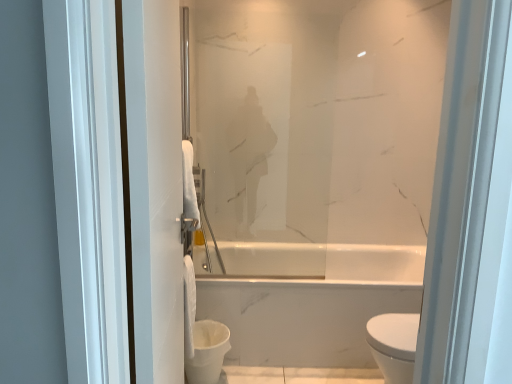
Question: Is white glossy toilet bowl at lower center to the left or to the right of satin glass mirror at center in the image?

Choices:
 (A) right
 (B) left

Answer: (B)

Question: In terms of width, does white glossy toilet bowl at lower center look wider or thinner when compared to satin glass mirror at center?

Choices:
 (A) wide
 (B) thin

Answer: (A)

Question: Considering the real-world distances, which object is farthest from the satin glass mirror at center?

Choices:
 (A) white matte towel at left
 (B) white glossy toilet bowl at lower center
 (C) white fluffy toilet paper at center

Answer: (B)

Question: Which is nearer to the white matte towel at left?

Choices:
 (A) satin glass mirror at center
 (B) white glossy toilet bowl at lower center
 (C) white fluffy toilet paper at center

Answer: (B)